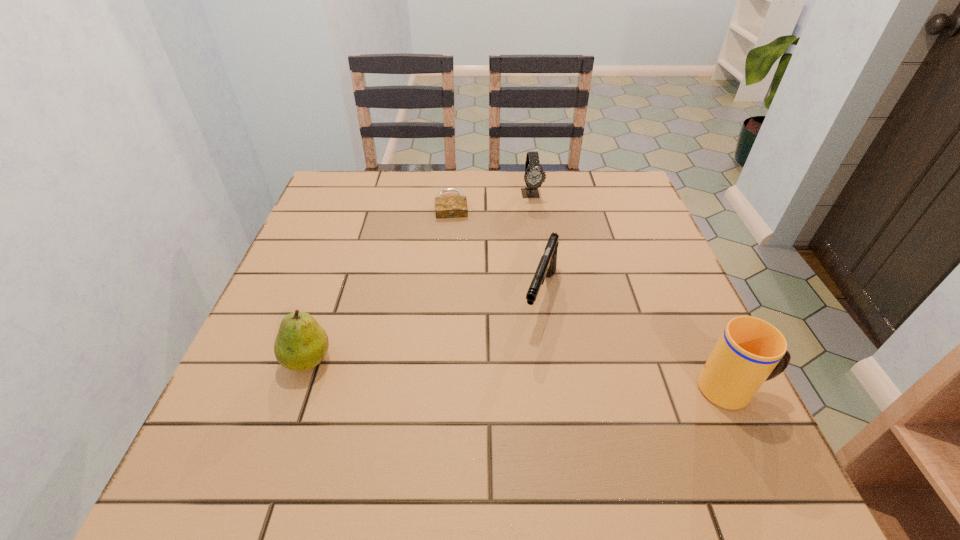
Identify the location of free spot on the desktop that is between the leftmost object and the rightmost object and is positioned at the aiming end of the third farthest object. The image size is (960, 540). (512, 374).

I want to click on vacant space on the desktop that is between the leftmost object and the rightmost object and is positioned on the keyhole side of the fourth object from right to left, so click(462, 370).

Find the location of a particular element. free spot on the desktop that is between the pear and the rightmost object and is positioned on the face of the watch is located at coordinates [x=572, y=378].